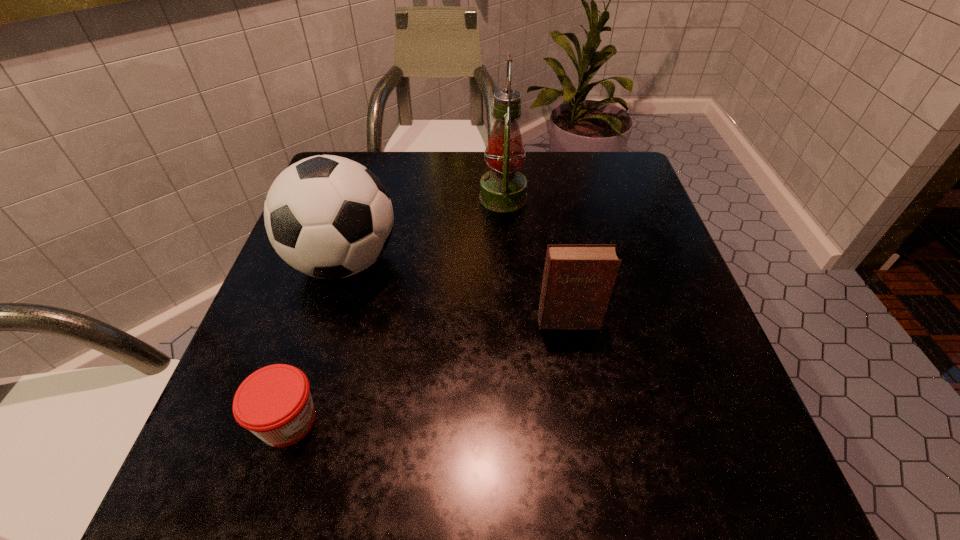
This screenshot has height=540, width=960. What are the coordinates of `vacant space at the right edge of the desktop` in the screenshot? It's located at (742, 410).

What are the coordinates of `vacant space at the far left corner of the desktop` in the screenshot? It's located at (373, 171).

Locate an element on the screen. free location at the near right corner of the desktop is located at coordinates (736, 508).

Identify the location of empty space that is in between the diary and the oil lamp. (536, 260).

The width and height of the screenshot is (960, 540). I want to click on unoccupied position between the soccer ball and the second shortest object, so click(456, 292).

At what (x,y) coordinates should I click in order to perform the action: click on free space between the third farthest object and the oil lamp. Please return your answer as a coordinate pair (x, y). Looking at the image, I should click on (536, 260).

You are a GUI agent. You are given a task and a screenshot of the screen. Output one action in this format:
    pyautogui.click(x=<x>, y=<y>)
    Task: Click on the free space that is in between the soccer ball and the jam
    
    Given the screenshot: What is the action you would take?
    pyautogui.click(x=316, y=341)

I want to click on unoccupied area between the third nearest object and the diary, so click(x=456, y=292).

Find the location of `vacant area that lies between the diary and the farthest object`. vacant area that lies between the diary and the farthest object is located at coordinates (536, 260).

Find the location of a particular element. vacant point located between the nearest object and the third shortest object is located at coordinates (316, 341).